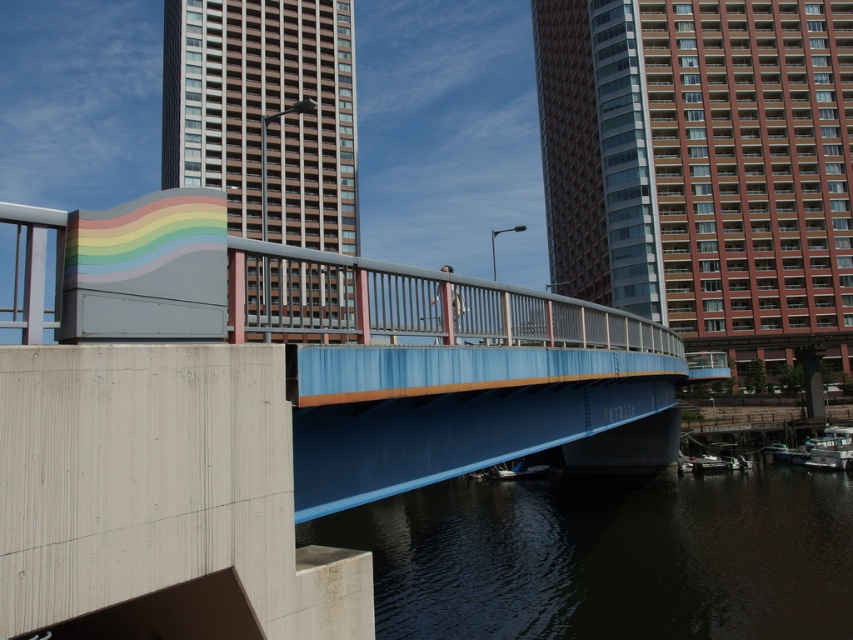
Which is more to the right, dark water at lower center or matte gray building at center?

dark water at lower center

Identify the location of dark water at lower center. The height and width of the screenshot is (640, 853). (608, 557).

Between point (561, 544) and point (221, 131), which one is positioned in front?

Positioned in front is point (561, 544).

You are a GUI agent. You are given a task and a screenshot of the screen. Output one action in this format:
    pyautogui.click(x=<x>, y=<y>)
    Task: Click on the dark water at lower center
    This screenshot has height=640, width=853.
    Given the screenshot: What is the action you would take?
    pyautogui.click(x=608, y=557)

Is brick textured building at upper right further to camera compared to matte gray building at center?

Yes.

Does brick textured building at upper right have a smaller size compared to matte gray building at center?

Yes.

Find the location of `brick textured building at upper right`. brick textured building at upper right is located at coordinates (700, 163).

Locate an element on the screen. brick textured building at upper right is located at coordinates (700, 163).

Between brick textured building at upper right and dark water at lower center, which one is positioned lower?

dark water at lower center is lower down.

Can you confirm if brick textured building at upper right is wider than dark water at lower center?

Yes.

Does point (817, 12) come farther from viewer compared to point (585, 550)?

Yes, it is behind point (585, 550).

This screenshot has height=640, width=853. In order to click on brick textured building at upper right in this screenshot , I will do `click(700, 163)`.